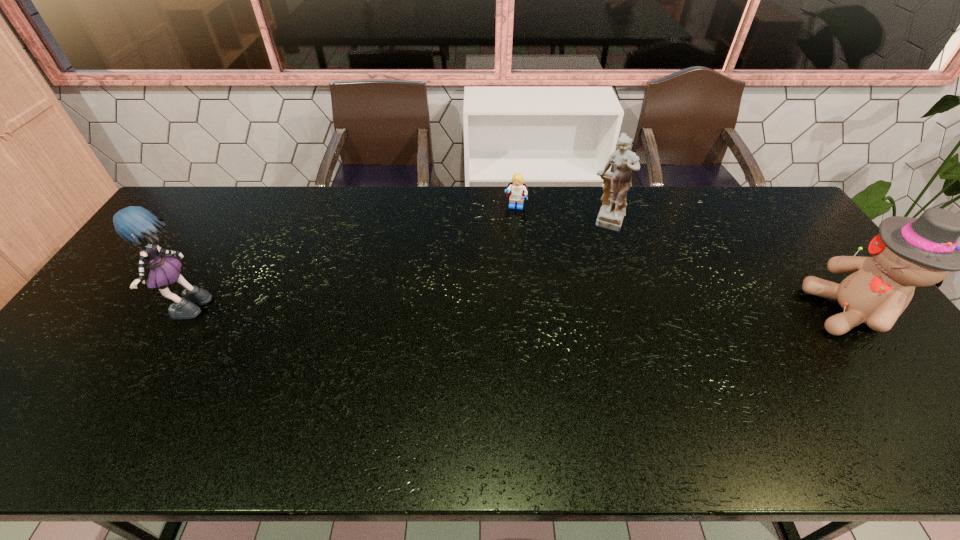
This screenshot has height=540, width=960. In the image, there is a desktop. In order to click on vacant space at the far edge in this screenshot , I will do `click(319, 211)`.

What are the coordinates of `vacant region at the near edge` in the screenshot? It's located at (348, 386).

The width and height of the screenshot is (960, 540). Identify the location of free space at the left edge of the desktop. (136, 322).

Identify the location of free space at the right edge. The height and width of the screenshot is (540, 960). (830, 273).

The height and width of the screenshot is (540, 960). In order to click on vacant space at the near left corner of the desktop in this screenshot , I will do `click(84, 408)`.

Where is `vacant area at the far right corner`? This screenshot has width=960, height=540. vacant area at the far right corner is located at coordinates (759, 192).

Locate an element on the screen. The height and width of the screenshot is (540, 960). vacant area that lies between the third object from right to left and the figurine is located at coordinates (562, 215).

Locate an element on the screen. free space between the rightmost object and the third object from right to left is located at coordinates (683, 259).

Find the location of a particular element. empty space between the leftmost object and the second object from right to left is located at coordinates (398, 267).

The width and height of the screenshot is (960, 540). In order to click on vacant region between the leftmost object and the third object from left to right in this screenshot , I will do `click(398, 267)`.